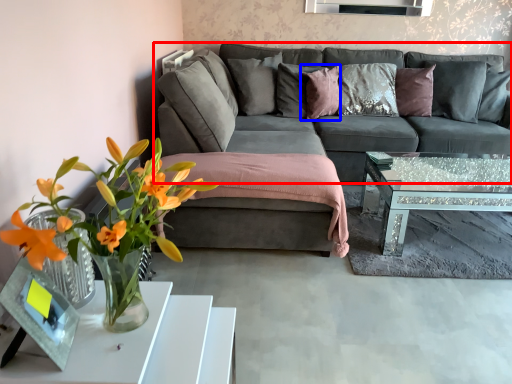
Question: Which of the following is the closest to the observer, studio couch (highlighted by a red box) or pillow (highlighted by a blue box)?

Choices:
 (A) studio couch
 (B) pillow

Answer: (A)